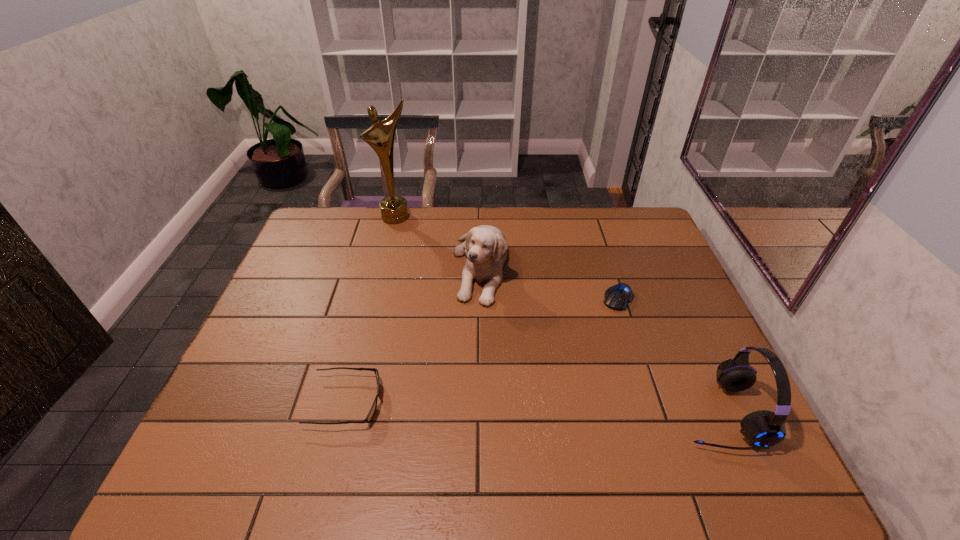
Where is `free spot at the right edge of the desktop`? free spot at the right edge of the desktop is located at coordinates (653, 294).

Locate an element on the screen. The height and width of the screenshot is (540, 960). vacant region at the far left corner of the desktop is located at coordinates coord(327,213).

This screenshot has width=960, height=540. I want to click on vacant region at the near right corner of the desktop, so click(x=693, y=407).

I want to click on vacant region between the second object from right to left and the headset, so click(668, 355).

You are a GUI agent. You are given a task and a screenshot of the screen. Output one action in this format:
    pyautogui.click(x=<x>, y=<y>)
    Task: Click on the free space between the farthest object and the headset
    
    Given the screenshot: What is the action you would take?
    pyautogui.click(x=557, y=315)

In order to click on vacant region between the shortest object and the sunglasses in this screenshot , I will do `click(482, 350)`.

At what (x,y) coordinates should I click in order to perform the action: click on vacant area that lies between the third object from left to right and the second shortest object. Please return your answer as a coordinate pair (x, y). The height and width of the screenshot is (540, 960). Looking at the image, I should click on (413, 335).

Identify the location of free space between the sunglasses and the shortest object. (482, 350).

I want to click on free spot between the headset and the shortest object, so click(x=668, y=355).

The height and width of the screenshot is (540, 960). I want to click on blank region between the tallest object and the shortest object, so click(x=507, y=258).